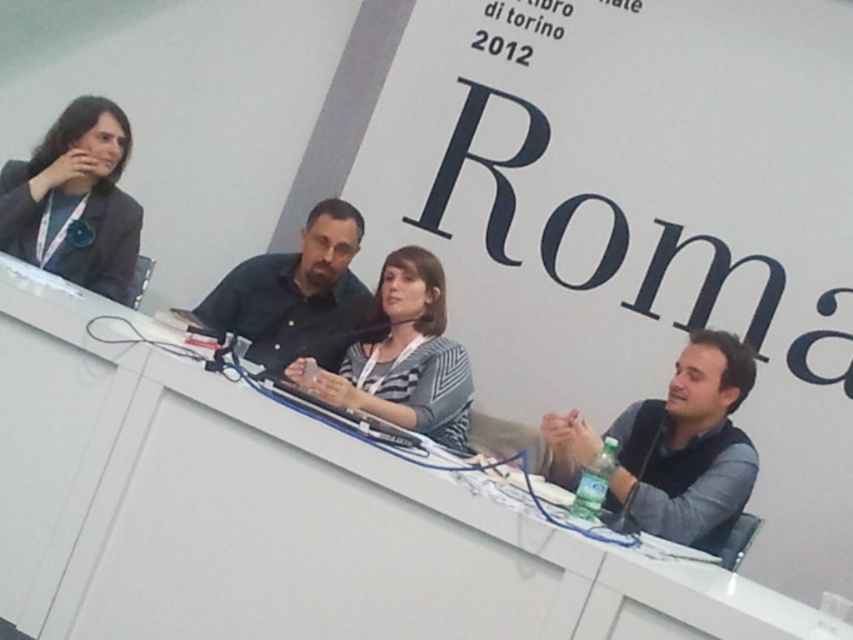
What are the coordinates of the white plastic table at center?

The coordinates of the white plastic table at center are at point (277,515).

You are attending a panel discussion at a conference in Rome. You see a white plastic table at center and a gray fabric vest at right. Which object is positioned to the left of the other?

The white plastic table at center is to the left of gray fabric vest at right according to the description.

What is the object located at coordinates point (688, 445) in the image?

The point (688, 445) is on gray fabric vest at right.